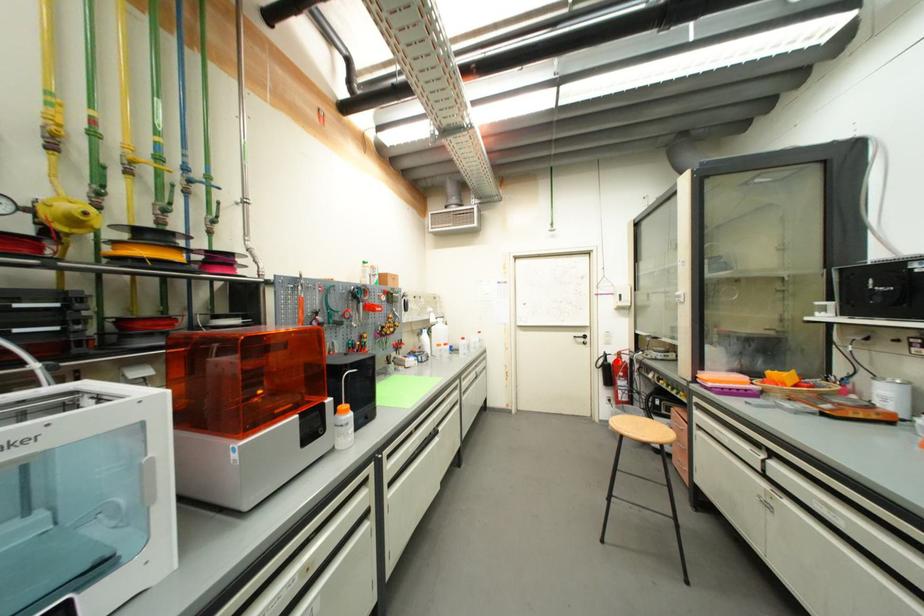
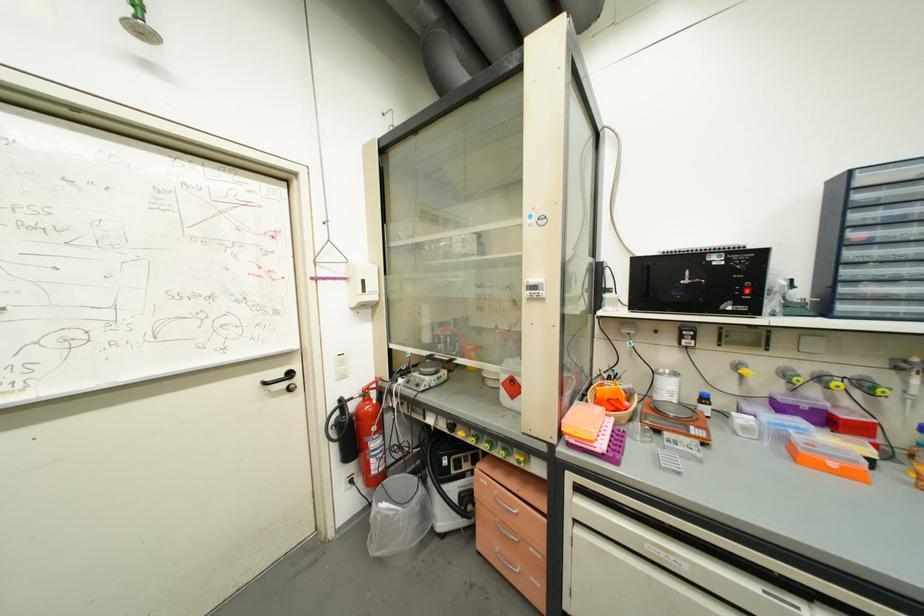
Find the pixel in the second image that matches the highlighted location in the first image.

(358, 408)